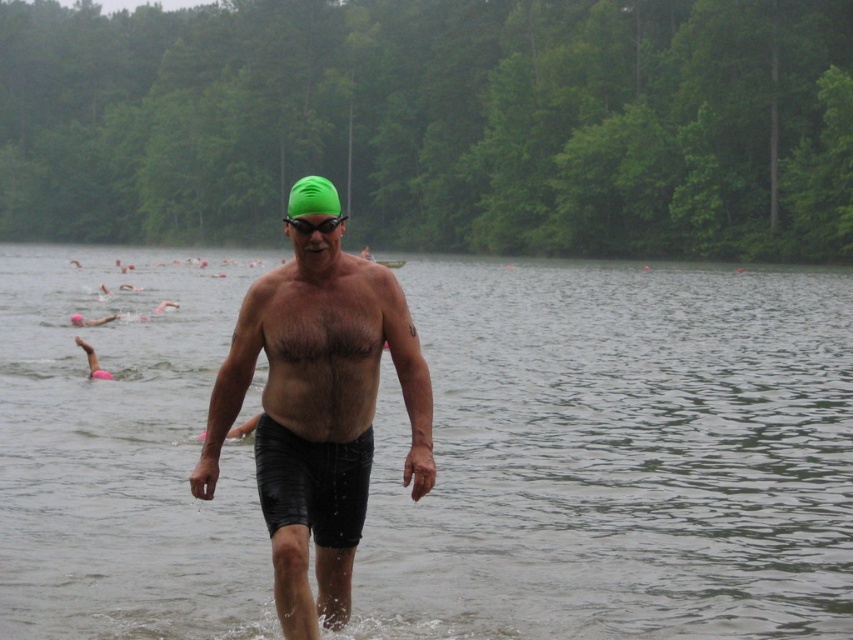
Is green matte swim cap at center shorter than black rubber shorts at center?

Incorrect, green matte swim cap at center's height does not fall short of black rubber shorts at center's.

Is green matte swim cap at center thinner than black rubber shorts at center?

No, green matte swim cap at center is not thinner than black rubber shorts at center.

Is point (285, 444) positioned after point (345, 449)?

No, it is not.

Where is `green matte swim cap at center`? Image resolution: width=853 pixels, height=640 pixels. green matte swim cap at center is located at coordinates (318, 413).

Is point (50, 344) positioned after point (329, 612)?

That is True.

Describe the element at coordinates (618, 456) in the screenshot. This screenshot has width=853, height=640. I see `clear water at center` at that location.

Identify the location of clear water at center. (618, 456).

Does clear water at center have a lesser width compared to black rubber shorts at center?

No, clear water at center is not thinner than black rubber shorts at center.

Which is more to the right, clear water at center or black rubber shorts at center?

From the viewer's perspective, black rubber shorts at center appears more on the right side.

Is point (183, 310) farther from camera compared to point (316, 461)?

Yes, it is.

The image size is (853, 640). Identify the location of clear water at center. (618, 456).